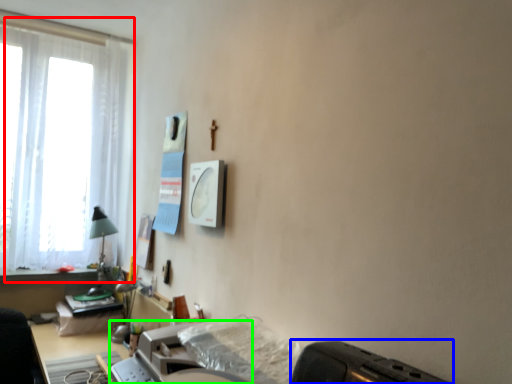
Question: Estimate the real-world distances between objects in this image. Which object is closer to window (highlighted by a red box), appliance (highlighted by a blue box) or printer (highlighted by a green box)?

Choices:
 (A) appliance
 (B) printer

Answer: (B)